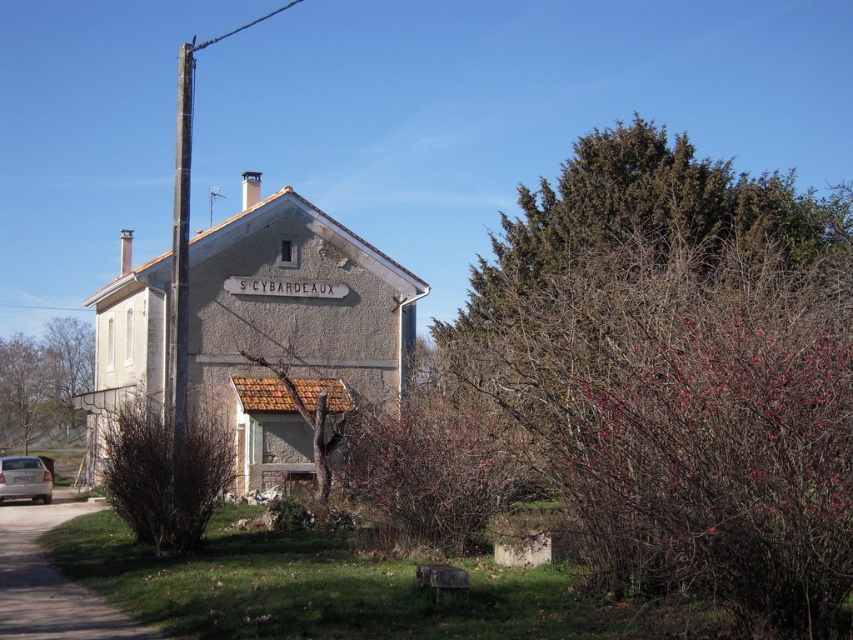
Does white stone sign at center appear over silver metallic car at lower left?

Indeed, white stone sign at center is positioned over silver metallic car at lower left.

Image resolution: width=853 pixels, height=640 pixels. I want to click on white stone sign at center, so click(x=285, y=288).

Who is lower down, bare branches at left or silver metallic car at lower left?

silver metallic car at lower left

Where is `bare branches at left`? The image size is (853, 640). bare branches at left is located at coordinates (44, 381).

Measure the distance between bare branches at left and camera.

A distance of 61.84 meters exists between bare branches at left and camera.

This screenshot has width=853, height=640. In order to click on bare branches at left in this screenshot , I will do `click(44, 381)`.

Can you confirm if smooth gray pole at left is bigger than white stone sign at center?

Correct, smooth gray pole at left is larger in size than white stone sign at center.

Is smooth gray pole at left shorter than white stone sign at center?

No.

Identify the location of smooth gray pole at left. The image size is (853, 640). (180, 262).